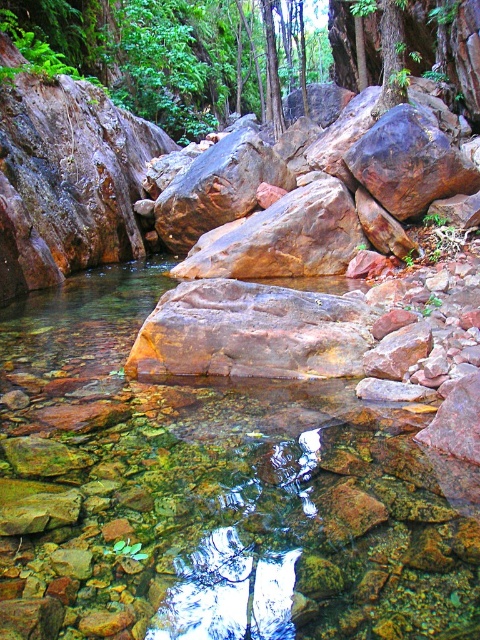
Can you confirm if clear glass stream at center is smaller than rustic brown rock at center?

Yes.

Is point (303, 573) positioned in front of point (240, 138)?

Yes, point (303, 573) is closer to viewer.

Which is behind, point (40, 604) or point (186, 196)?

The point (186, 196) is more distant.

Find the location of a particular element. clear glass stream at center is located at coordinates (213, 493).

This screenshot has width=480, height=640. Describe the element at coordinates (213, 493) in the screenshot. I see `clear glass stream at center` at that location.

How far apart are clear glass stream at center and brown/rough rock at center?

clear glass stream at center is 3.66 feet away from brown/rough rock at center.

Find the location of a particular element. clear glass stream at center is located at coordinates (213, 493).

Who is taller, brown/rough rock at center or rustic brown rock at center?

rustic brown rock at center is taller.

Is brown/rough rock at center wider than rustic brown rock at center?

No, brown/rough rock at center is not wider than rustic brown rock at center.

What are the coordinates of `brown/rough rock at center` in the screenshot? It's located at (252, 332).